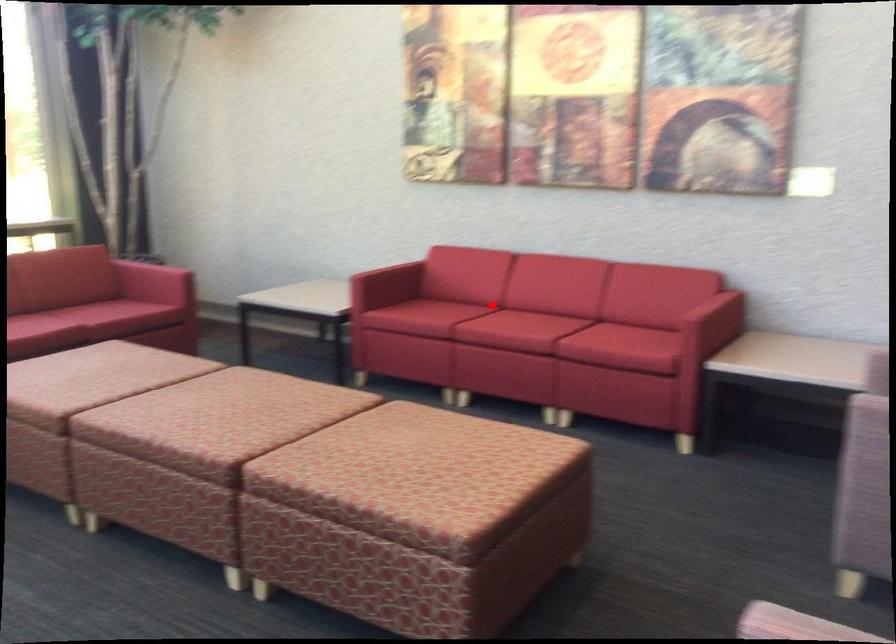
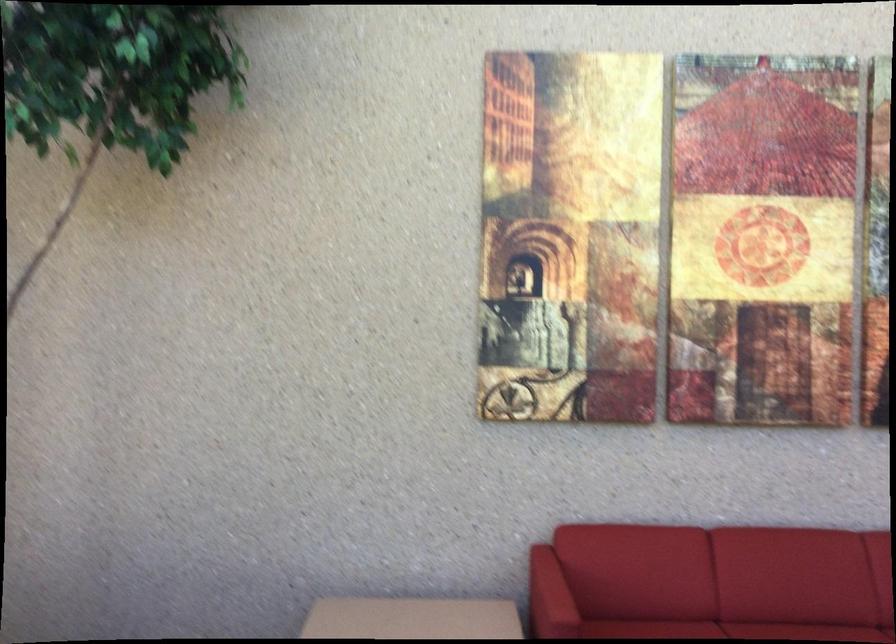
Question: A red point is marked in image1. In image2, is the corresponding 3D point closer to the camera or farther? Reply with the corresponding letter.

Choices:
 (A) The corresponding 3D point is closer.
 (B) The corresponding 3D point is farther.

Answer: (A)